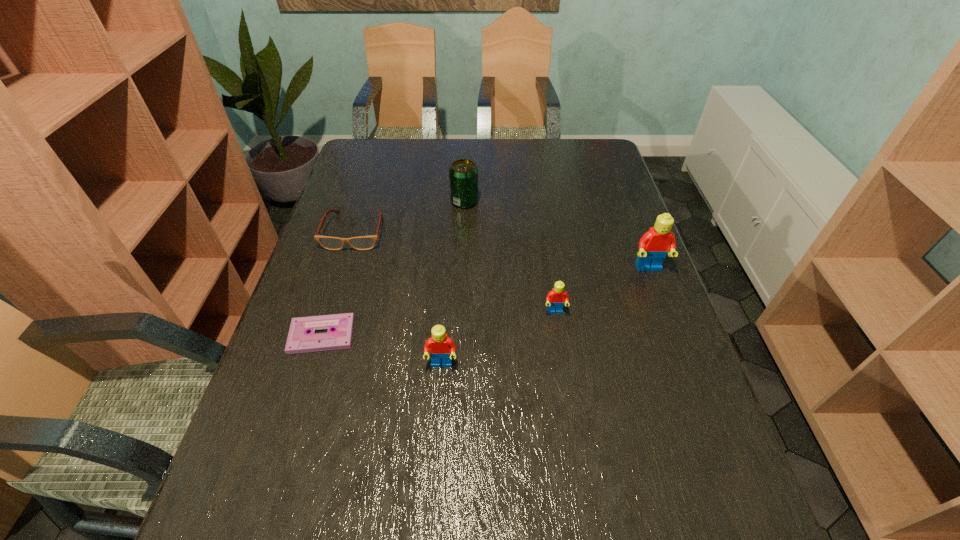
I want to click on the nearest Lego, so click(x=441, y=346).

In order to click on the second shortest Lego in this screenshot , I will do `click(441, 346)`.

In order to click on the fourth tallest object in this screenshot , I will do `click(556, 298)`.

Find the location of a particular element. The image size is (960, 540). the second nearest Lego is located at coordinates pos(556,298).

At what (x,y) coordinates should I click in order to perform the action: click on the rightmost object. Please return your answer as a coordinate pair (x, y). The height and width of the screenshot is (540, 960). Looking at the image, I should click on (654, 245).

At what (x,y) coordinates should I click in order to perform the action: click on the tallest Lego. Please return your answer as a coordinate pair (x, y). The image size is (960, 540). Looking at the image, I should click on (654, 245).

Locate an element on the screen. This screenshot has height=540, width=960. beer can is located at coordinates (463, 173).

Where is `the shortest object`? the shortest object is located at coordinates coord(299,340).

At what (x,y) coordinates should I click in order to perform the action: click on the fifth tallest object. Please return your answer as a coordinate pair (x, y). Looking at the image, I should click on (368, 242).

Identify the location of spectacles. This screenshot has height=540, width=960. (368, 242).